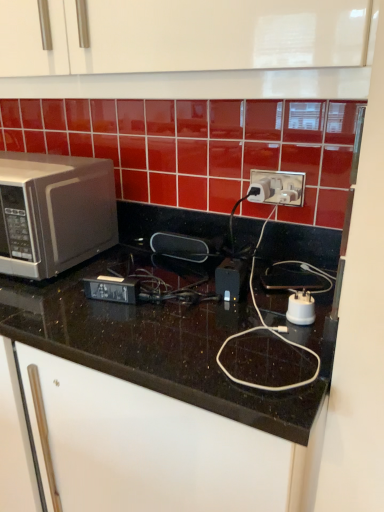
Question: In the image, is white plastic power plugs and sockets at center positioned in front of or behind black rubberized speaker at center, which appears as the 2th appliance when viewed from the front?

Choices:
 (A) behind
 (B) front

Answer: (B)

Question: From their relative heights in the image, would you say white plastic power plugs and sockets at center is taller or shorter than black rubberized speaker at center, which appears as the 2th appliance when viewed from the front?

Choices:
 (A) short
 (B) tall

Answer: (B)

Question: Considering the real-world distances, which object is farthest from the white plastic power plugs and sockets at center?

Choices:
 (A) black rubberized speaker at center, marked as the first appliance in a top-to-bottom arrangement
 (B) white plastic plug at center, which appears as the first appliance when ordered from the bottom
 (C) black granite countertop at center
 (D) satin silver microwave at left

Answer: (D)

Question: Which object is the closest to the white plastic plug at center, which appears as the first appliance when ordered from the bottom?

Choices:
 (A) white plastic power plugs and sockets at center
 (B) black granite countertop at center
 (C) satin silver microwave at left
 (D) black rubberized speaker at center, the first appliance positioned from the back

Answer: (B)